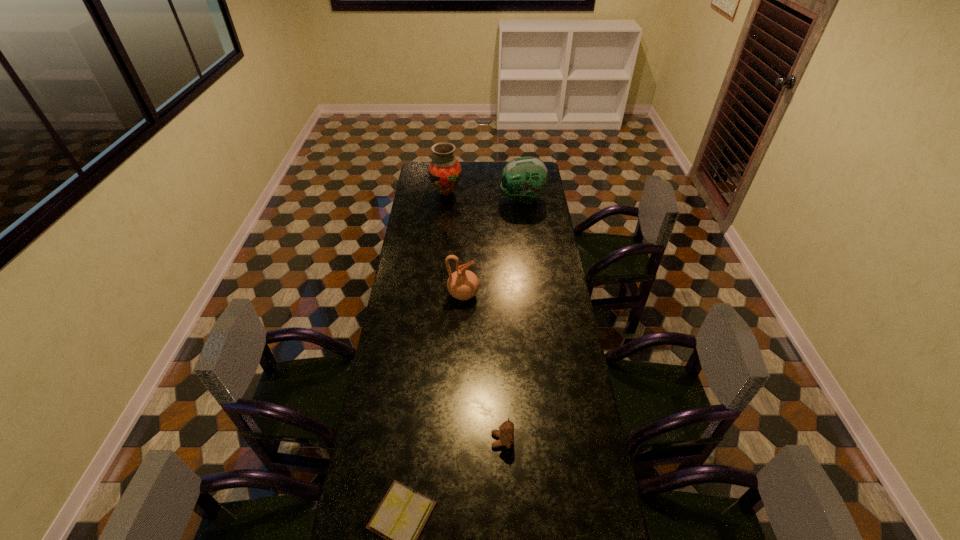
The height and width of the screenshot is (540, 960). Identify the location of vacant region located on the face of the fourth farthest object. (449, 440).

Locate an element on the screen. free spot located on the face of the fourth farthest object is located at coordinates (462, 440).

Identify the location of free location located on the face of the fourth farthest object. Image resolution: width=960 pixels, height=540 pixels. (405, 440).

Locate an element on the screen. The image size is (960, 540). object located in the left edge section of the desktop is located at coordinates [x=444, y=171].

Locate an element on the screen. object positioned at the right edge is located at coordinates (524, 178).

Find the location of `free space at the far edge`. free space at the far edge is located at coordinates (487, 178).

This screenshot has width=960, height=540. In order to click on free space at the left edge of the desktop in this screenshot , I will do `click(413, 279)`.

Image resolution: width=960 pixels, height=540 pixels. Find the location of `vacant space at the right edge of the desktop`. vacant space at the right edge of the desktop is located at coordinates (548, 227).

Locate an element on the screen. The width and height of the screenshot is (960, 540). free space between the teddy bear and the vase is located at coordinates (474, 316).

Find the location of a particular element. The height and width of the screenshot is (540, 960). vacant space in between the football helmet and the third farthest object is located at coordinates (492, 246).